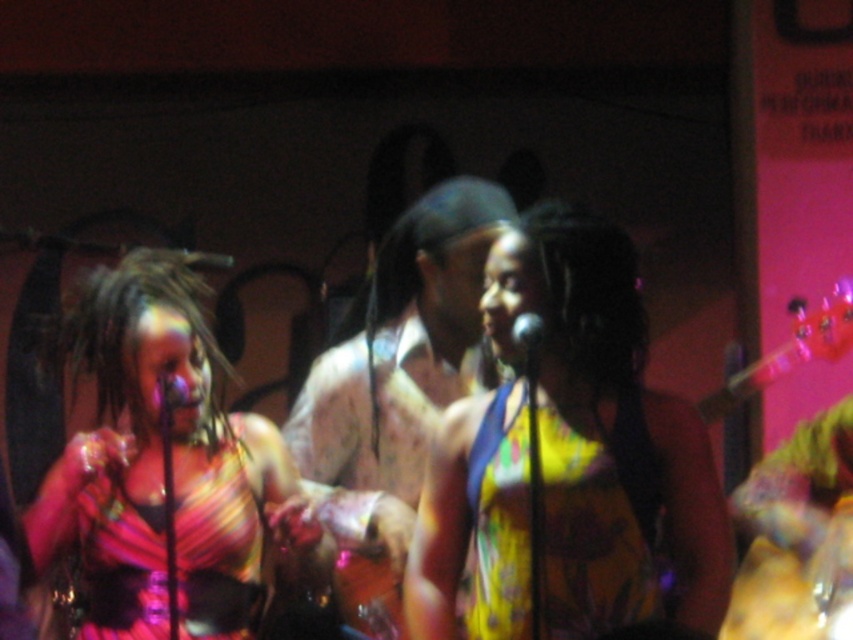
Question: Does shiny metallic dress at left come in front of multicolored satin dress at center?

Choices:
 (A) no
 (B) yes

Answer: (B)

Question: Which object is farther from the camera taking this photo?

Choices:
 (A) metallic shiny microphone at center
 (B) multicolored satin dress at center
 (C) patterned fabric shirt at center
 (D) black matte microphone at center

Answer: (C)

Question: Does yellow floral dress at center appear over patterned fabric shirt at center?

Choices:
 (A) yes
 (B) no

Answer: (B)

Question: Which object is positioned farthest from the black matte microphone at center?

Choices:
 (A) shiny metallic dress at left
 (B) yellow printed fabric dress at center

Answer: (A)

Question: Can you confirm if multicolored satin dress at center is thinner than metallic shiny microphone at center?

Choices:
 (A) yes
 (B) no

Answer: (B)

Question: Estimate the real-world distances between objects in this image. Which object is closer to the metallic shiny microphone at center?

Choices:
 (A) yellow floral dress at center
 (B) shiny metallic dress at left

Answer: (B)